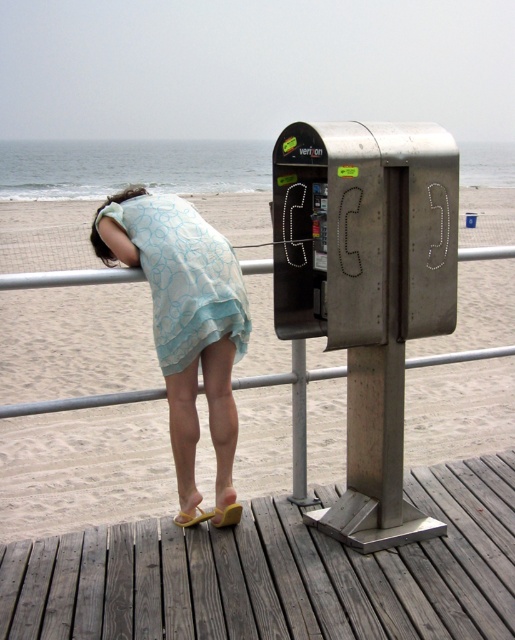
Question: Does light blue sheer dress at center appear on the left side of yellow rubber sandal at lower center?

Choices:
 (A) yes
 (B) no

Answer: (A)

Question: Is light blue sheer dress at center below yellow rubber sandal at lower center?

Choices:
 (A) no
 (B) yes

Answer: (A)

Question: Among these points, which one is nearest to the camera?

Choices:
 (A) (239, 516)
 (B) (197, 284)
 (C) (39, 614)
 (D) (221, 465)

Answer: (C)

Question: Can you confirm if sandy beige beach at lower left is smaller than light blue sheer dress at center?

Choices:
 (A) yes
 (B) no

Answer: (B)

Question: Which point is closer to the camera taking this photo?

Choices:
 (A) (197, 292)
 (B) (180, 513)
 (C) (448, 573)
 (D) (211, 520)

Answer: (C)

Question: Which of the following is the closest to the observer?

Choices:
 (A) light blue sheer dress at center
 (B) yellow rubber sandal at lower center
 (C) sandy beige beach at lower left
 (D) light blue fabric dress at center

Answer: (A)